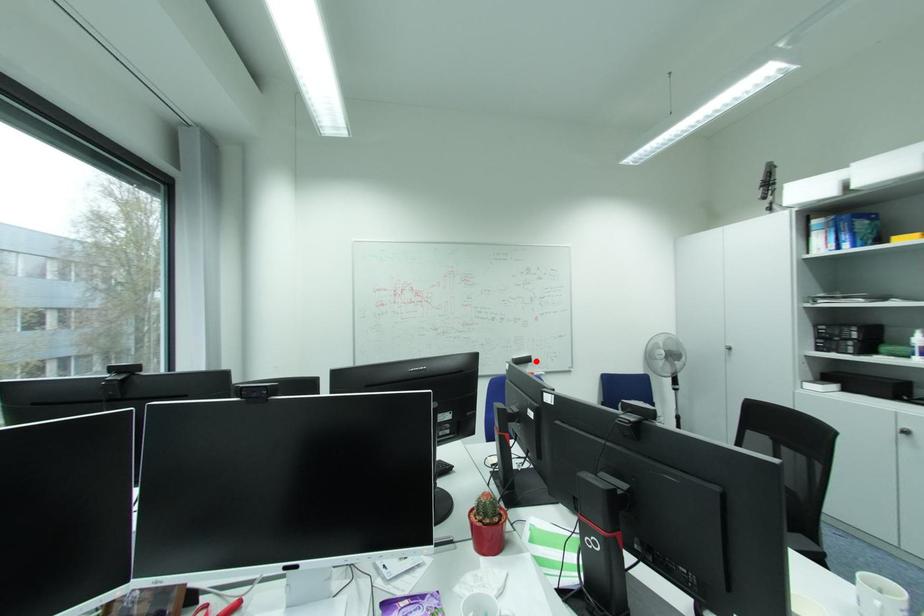
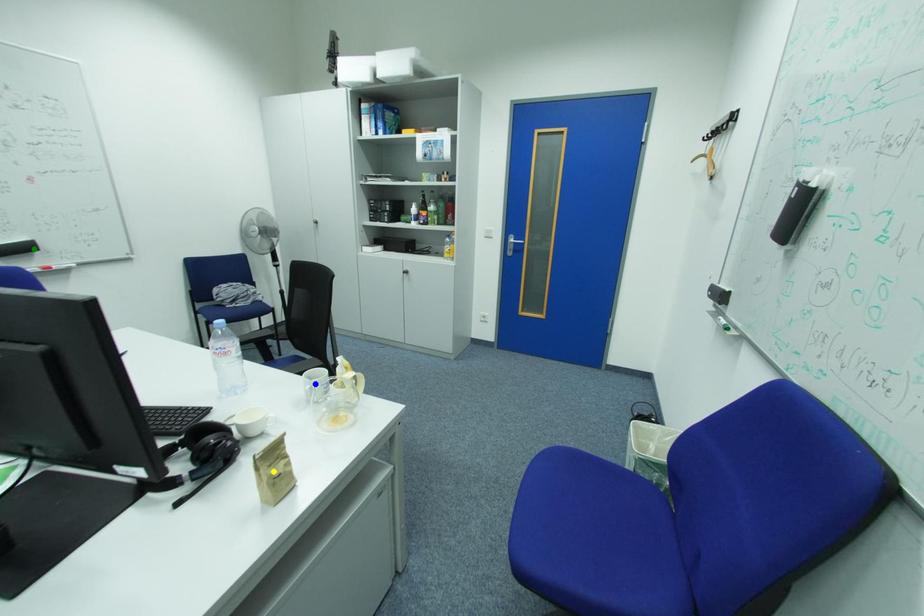
Question: I am providing you with two images of the same scene from different viewpoints. A red point is marked on the first image. You are given multiple points on the second image. Which point in image 2 is actually the same real-world point as the red point in image 1?

Choices:
 (A) yellow point
 (B) green point
 (C) blue point

Answer: (B)